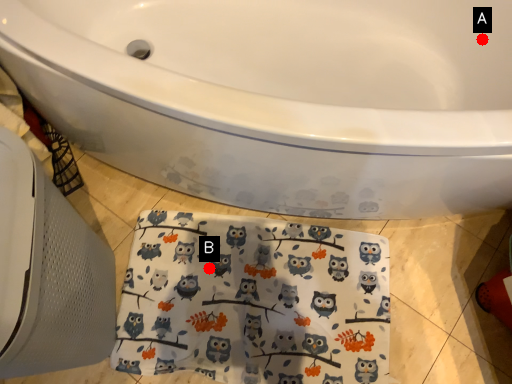
Question: Two points are circled on the image, labeled by A and B beside each circle. Which point is further to the camera?

Choices:
 (A) A is further
 (B) B is further

Answer: (B)